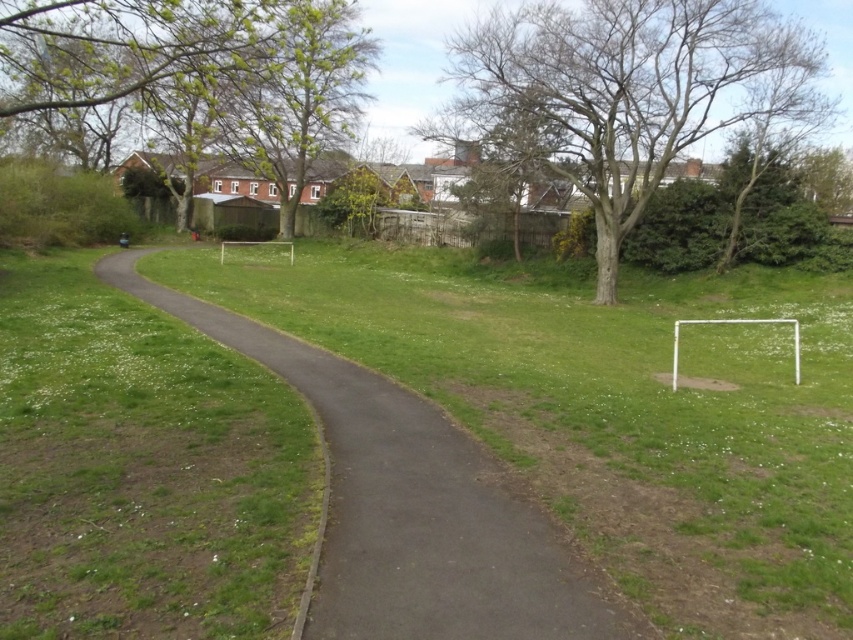
You are standing at the camera position in the park scene. There is a point marked at coordinates point (380, 580). Can you walk directly to that point from where you are standing?

The distance between point (380, 580) and the camera is 3.29 meters, so yes, you can walk directly to that point from the camera position as there is no obstruction mentioned in the scene description.

You are a landscape architect designing a new walking path. You want to place a bench between the dark gray asphalt at center and the bare wood tree at upper center. The bench requires 15 meters of space between the two landmarks to be placed safely. Is the current distance sufficient?

The distance between the dark gray asphalt at center and the bare wood tree at upper center is 12.59 meters, which is less than the required 15 meters. Therefore, the bench cannot be placed safely with the current spacing.

You are a delivery person trying to navigate through the park. You need to deliver a package to the address located near the bare wood tree at upper center. The dark gray asphalt at center is part of the path you must use. Which direction should you turn to reach the tree from the asphalt?

You should turn to the right to reach the bare wood tree at upper center from the dark gray asphalt at center, as the asphalt is located to the left of the tree.